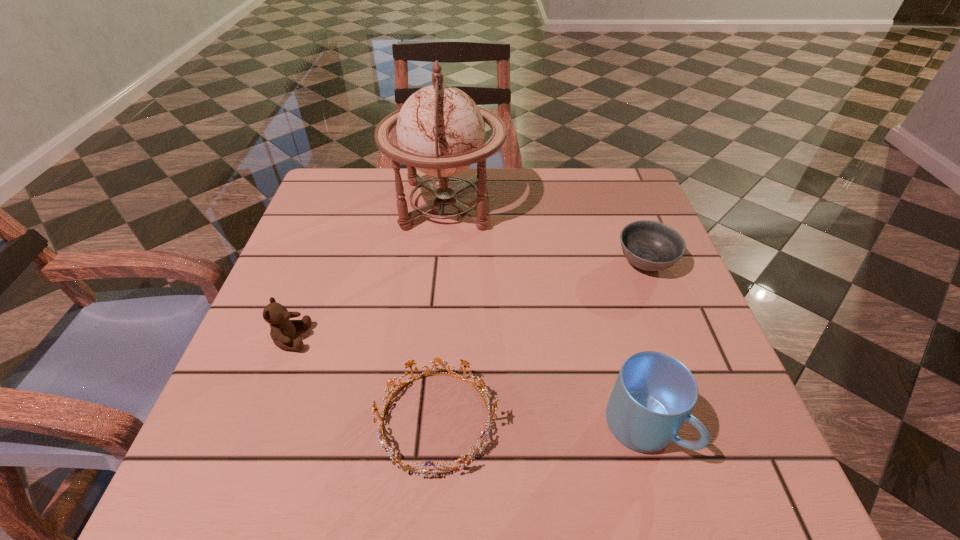
Find the location of a particular element. The height and width of the screenshot is (540, 960). the tallest object is located at coordinates (440, 130).

You are a GUI agent. You are given a task and a screenshot of the screen. Output one action in this format:
    pyautogui.click(x=<x>, y=<y>)
    Task: Click on the second tallest object
    
    Given the screenshot: What is the action you would take?
    [x=654, y=394]

The image size is (960, 540). I want to click on the third shortest object, so click(283, 330).

At what (x,y) coordinates should I click in order to perform the action: click on teddy bear. Please return your answer as a coordinate pair (x, y). The image size is (960, 540). Looking at the image, I should click on (283, 330).

I want to click on bowl, so click(649, 245).

Find the location of a particular element. tiara is located at coordinates (463, 461).

I want to click on vacant space situated at the front of the tallest object showing Africa, so click(x=562, y=205).

Identify the location of vacant space located 0.070m on the back of the fourth shortest object. Image resolution: width=960 pixels, height=540 pixels. (623, 358).

The height and width of the screenshot is (540, 960). What are the coordinates of `free space located 0.260m on the front-facing side of the leftmost object` in the screenshot? It's located at (448, 338).

This screenshot has width=960, height=540. What are the coordinates of `blank space located on the front of the bowl` in the screenshot? It's located at tap(670, 325).